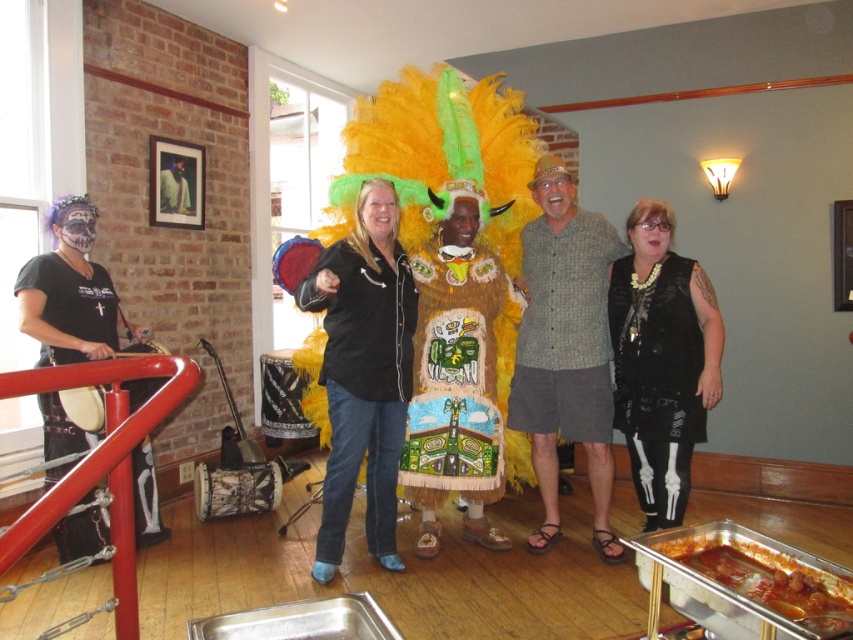
You are standing at the entrance of the room and see two points marked in the image. The first point is at coordinate point(392, 358) and the second point is at point(71, 356). Which point is closer to you?

Point(392, 358) is in front of point(71, 356), so the first point is closer to you.

You are standing in the room and want to move from the point at coordinates point (608,374) to the point at coordinates point (648,378). Can you walk directly between them without any obstacles?

Point (608,374) is behind point (648,378), so you cannot walk directly between them without passing behind the point (648,378).